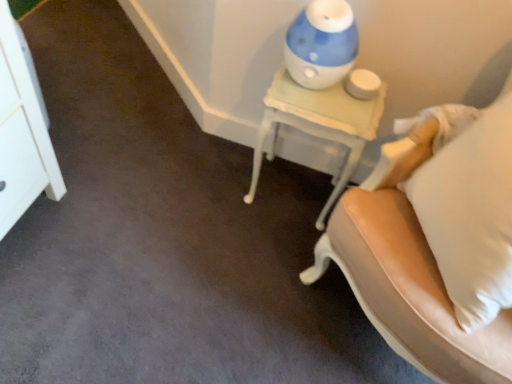
Find the location of a particular element. This screenshot has height=384, width=512. vacant space that's between white painted wood nightstand at upper right and white glossy dresser at upper left is located at coordinates (160, 152).